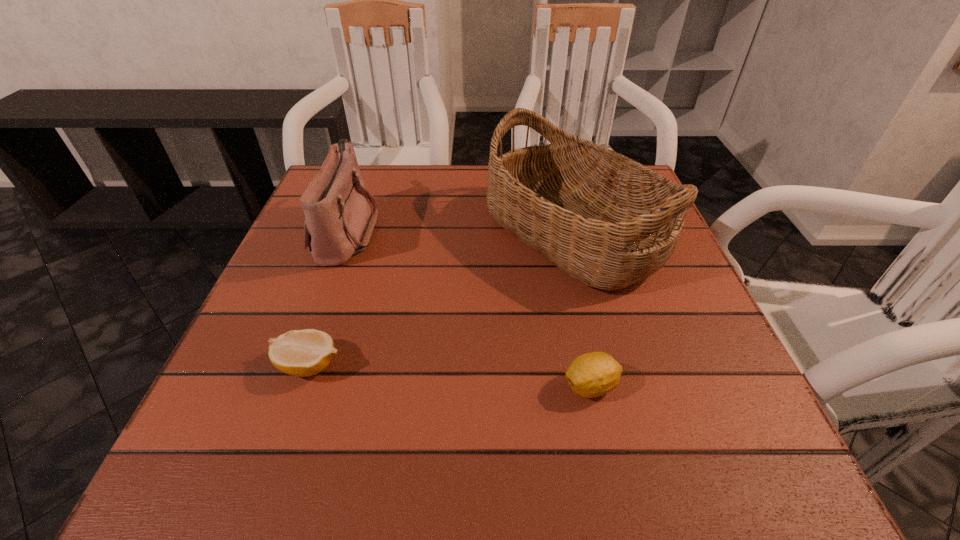
Identify the location of free space between the shortest object and the shoulder bag. This screenshot has width=960, height=540. (327, 298).

Where is `vacant area that lies between the shorter lemon and the basket`? vacant area that lies between the shorter lemon and the basket is located at coordinates click(x=441, y=299).

Image resolution: width=960 pixels, height=540 pixels. I want to click on vacant space that is in between the second tallest object and the shorter lemon, so click(327, 298).

Image resolution: width=960 pixels, height=540 pixels. I want to click on free space that is in between the basket and the third shortest object, so click(x=460, y=232).

Find the location of a particular element. This screenshot has width=960, height=540. object that stands as the second closest to the basket is located at coordinates (338, 223).

At what (x,y) coordinates should I click in order to perform the action: click on object that is the closest to the left lemon. Please return your answer as a coordinate pair (x, y). Looking at the image, I should click on (338, 223).

You are a GUI agent. You are given a task and a screenshot of the screen. Output one action in this format:
    pyautogui.click(x=<x>, y=<y>)
    Task: Click on the free space that satisfies the following two spatial constraints: 1. on the front pocket of the shoulder bag; 2. on the right side of the tallest object
    The height and width of the screenshot is (540, 960).
    Given the screenshot: What is the action you would take?
    pyautogui.click(x=346, y=233)

The width and height of the screenshot is (960, 540). Find the location of `vacant region that satisfies the following two spatial constraints: 1. on the front pocket of the second tallest object; 2. on the left side of the basket`. vacant region that satisfies the following two spatial constraints: 1. on the front pocket of the second tallest object; 2. on the left side of the basket is located at coordinates (346, 233).

In order to click on vacant space that satisfies the following two spatial constraints: 1. on the front pocket of the third shortest object; 2. on the right side of the tallest object in this screenshot , I will do `click(346, 233)`.

Where is `vacant point that satisfies the following two spatial constraints: 1. on the back side of the basket; 2. on the left side of the left lemon`? vacant point that satisfies the following two spatial constraints: 1. on the back side of the basket; 2. on the left side of the left lemon is located at coordinates (354, 233).